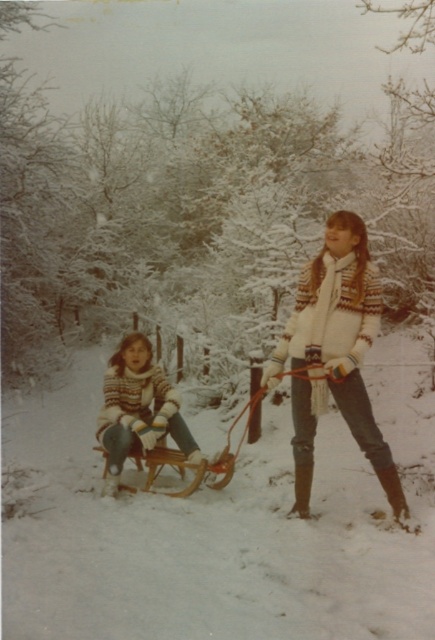
You are trying to decide which of the two sweaters to wear for a cold winter day. Both the white knitted sweater at center and the white wool sweater at center are available. Considering their sizes, which one would be more suitable for layering under a heavy coat?

The white knitted sweater at center is smaller in size compared to the white wool sweater at center. Since layering requires more space, the white wool sweater at center would be more suitable for layering under a heavy coat as it provides more room.

You are planning to take a photo of the white knitted sweater at center and the wooden sled at center in the snowy scene. Which object is narrower when viewed from your camera angle?

The white knitted sweater at center is narrower compared to the wooden sled at center.

You are standing at the point labeled point (114, 378) and want to move towards the point labeled point (221, 458). Which direction should you move to reach your destination?

To reach point (221, 458) from point (114, 378), you should move forward since point (114, 378) is behind point (221, 458).